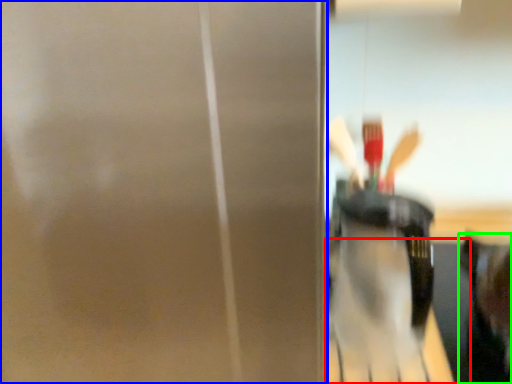
Question: Estimate the real-world distances between objects in this image. Which object is closer to table (highlighted by a red box), screen door (highlighted by a blue box) or person (highlighted by a green box)?

Choices:
 (A) screen door
 (B) person

Answer: (B)